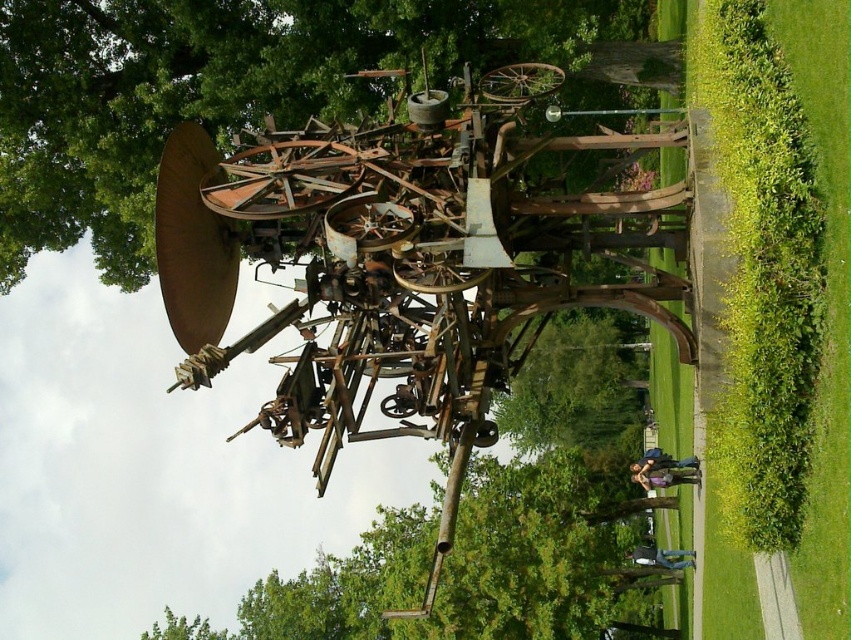
Does point (27, 157) come in front of point (326, 604)?

Yes, point (27, 157) is in front of point (326, 604).

Who is positioned more to the right, rusty metal sculpture at center or green leafy tree at center?

green leafy tree at center is more to the right.

Is point (607, 12) behind point (473, 620)?

That is False.

Locate an element on the screen. The image size is (851, 640). rusty metal sculpture at center is located at coordinates (220, 90).